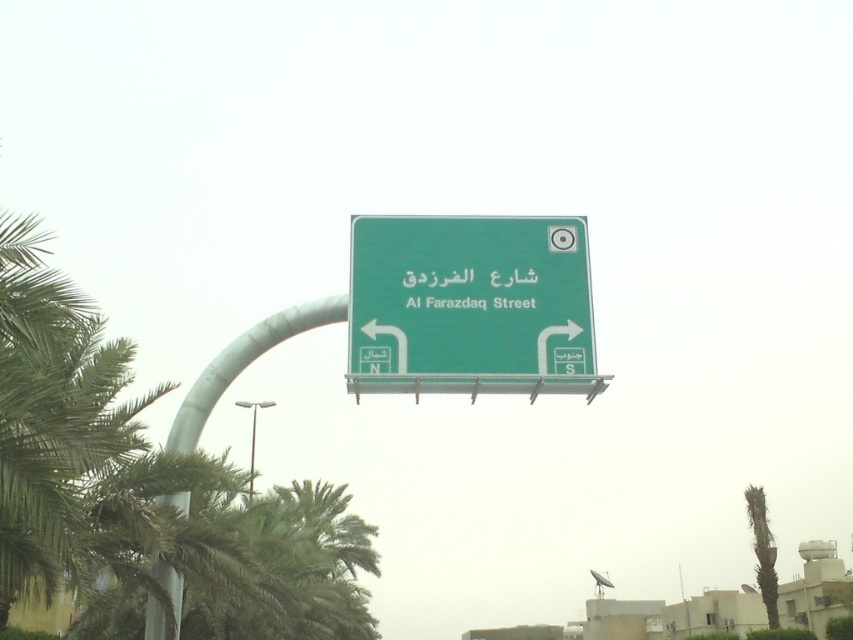
Can you confirm if green matte signboard at center is bigger than green metallic sign at center?

Yes, green matte signboard at center is bigger than green metallic sign at center.

Who is more distant from viewer, (424,280) or (497,285)?

Positioned behind is point (424,280).

Is point (425, 289) positioned after point (434, 307)?

That is True.

Locate an element on the screen. This screenshot has height=640, width=853. green matte signboard at center is located at coordinates point(469,294).